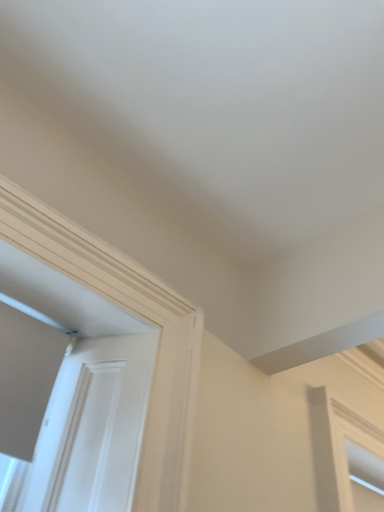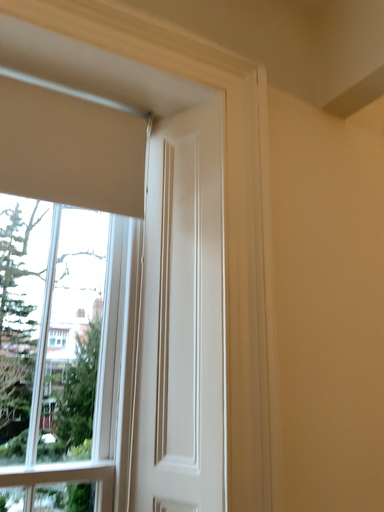
Question: How did the camera likely rotate when shooting the video?

Choices:
 (A) rotated downward
 (B) rotated upward

Answer: (A)